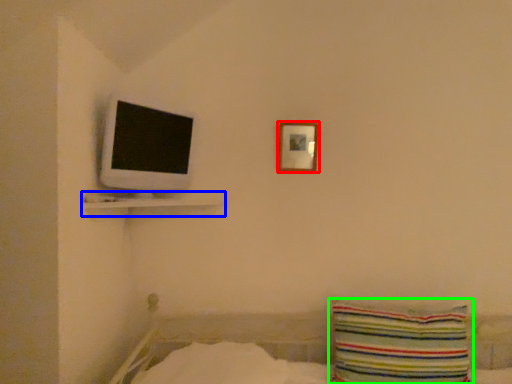
Question: Considering the real-world distances, which object is closest to picture frame (highlighted by a red box)? shelf (highlighted by a blue box) or pillow (highlighted by a green box).

Choices:
 (A) shelf
 (B) pillow

Answer: (A)